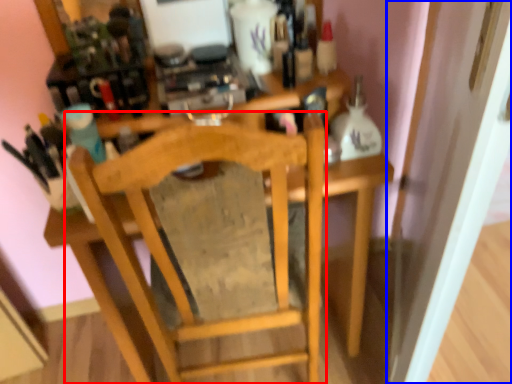
Question: Which of the following is the farthest to the observer, chair (highlighted by a red box) or door (highlighted by a blue box)?

Choices:
 (A) chair
 (B) door

Answer: (A)